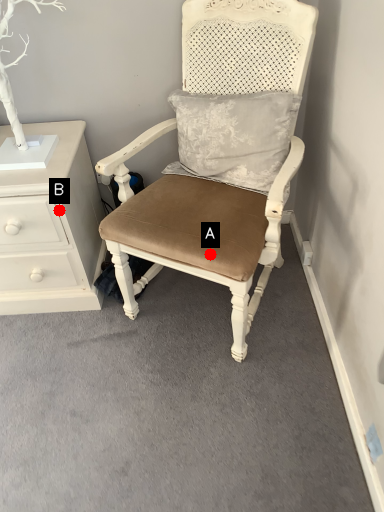
Question: Two points are circled on the image, labeled by A and B beside each circle. Which point is farther from the camera taking this photo?

Choices:
 (A) A is further
 (B) B is further

Answer: (B)